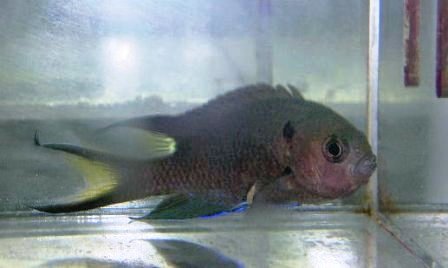
This screenshot has height=268, width=448. I want to click on corner of fish tank, so click(x=370, y=213).